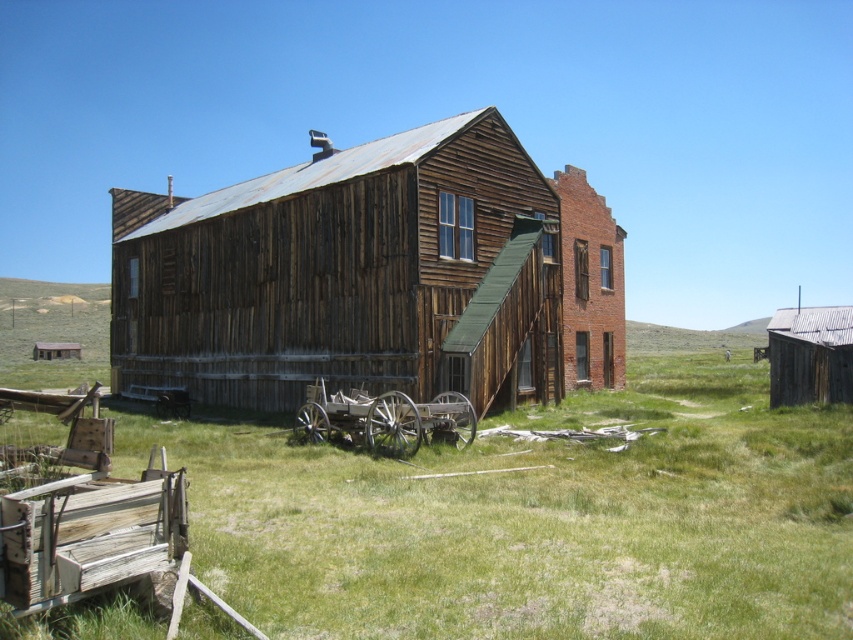
Question: Which point is closer to the camera?

Choices:
 (A) rusty corrugated tin hut at right
 (B) weathered wood building at center

Answer: (B)

Question: Which of the following is the farthest from the observer?

Choices:
 (A) rusty corrugated tin hut at right
 (B) weathered wood building at center
 (C) rustic wood wagon at center

Answer: (A)

Question: Can you confirm if rustic wood wagon at center is positioned to the left of rusty corrugated tin hut at right?

Choices:
 (A) no
 (B) yes

Answer: (B)

Question: Can you confirm if weathered wood building at center is positioned above rusty corrugated tin hut at right?

Choices:
 (A) yes
 (B) no

Answer: (A)

Question: Among these objects, which one is farthest from the camera?

Choices:
 (A) rustic wood wagon at center
 (B) rusty corrugated tin hut at right
 (C) weathered wood building at center

Answer: (B)

Question: Is weathered wood building at center thinner than rusty corrugated tin hut at right?

Choices:
 (A) yes
 (B) no

Answer: (B)